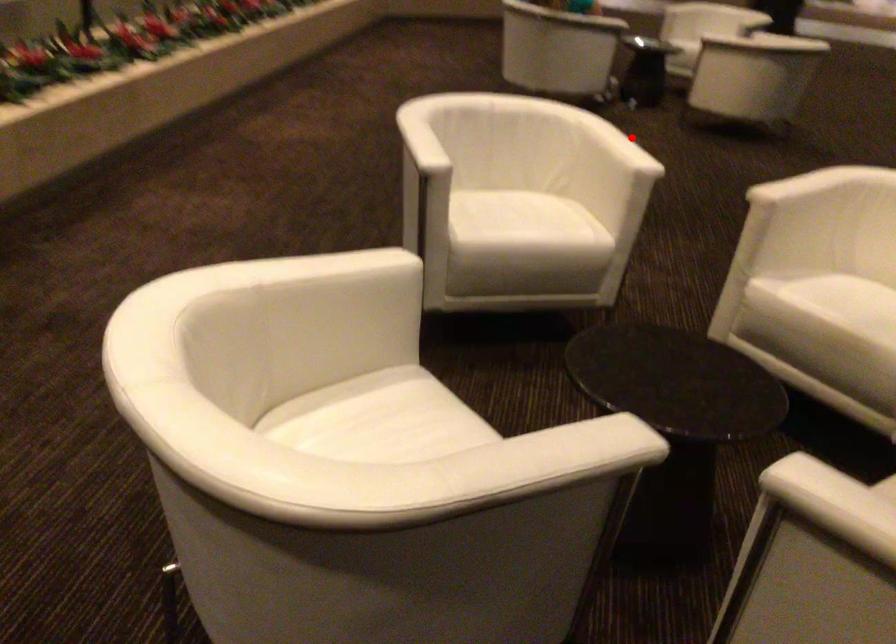
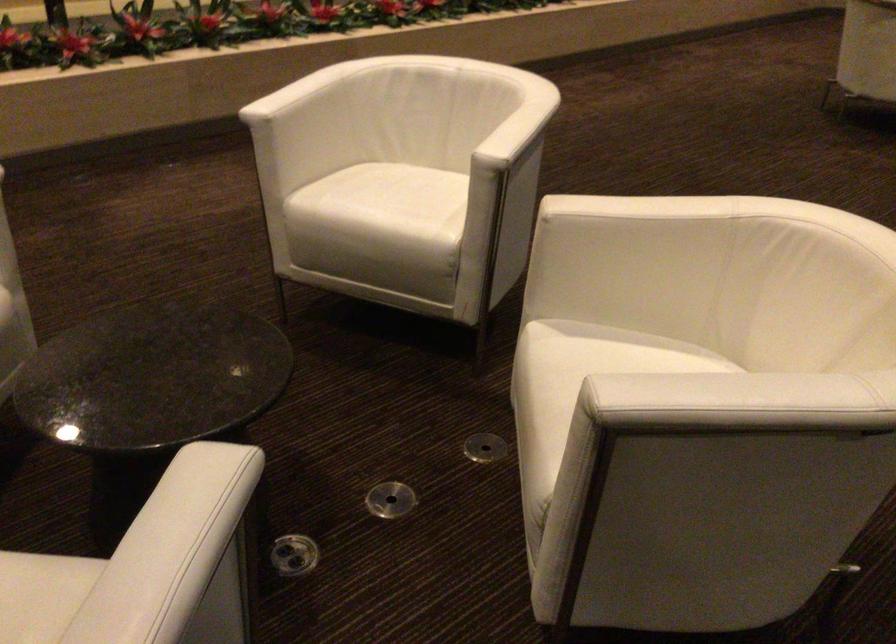
Locate, in the second image, the point that corresponds to the highlighted location in the first image.

(515, 122)